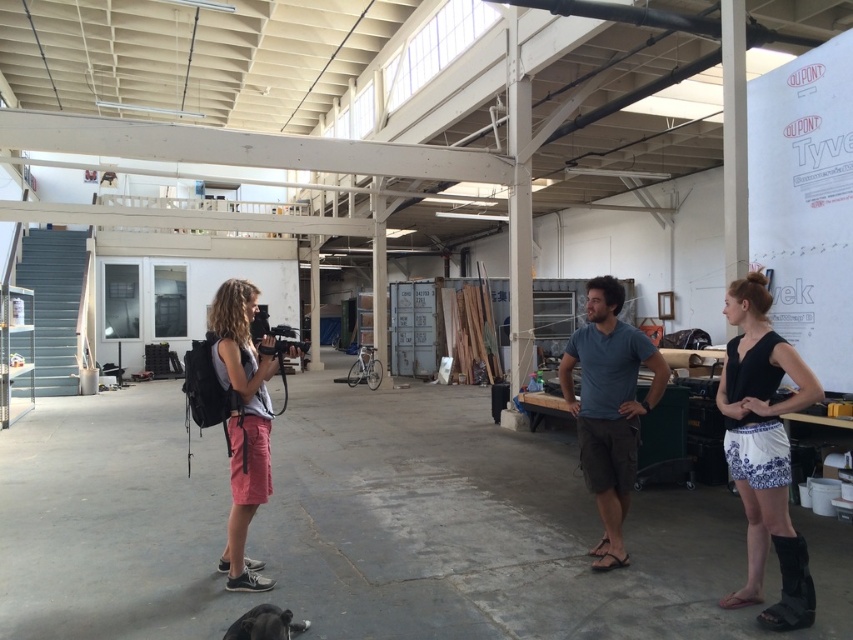
Question: Observing the image, what is the correct spatial positioning of blue cotton shirt at center in reference to matte black camera at left?

Choices:
 (A) above
 (B) below

Answer: (B)

Question: Which object is closer to the camera taking this photo?

Choices:
 (A) blue cotton shirt at center
 (B) matte black camera at left

Answer: (B)

Question: Is black matte shorts at right positioned in front of matte black camera at left?

Choices:
 (A) yes
 (B) no

Answer: (A)

Question: Which object is the farthest from the black matte shorts at right?

Choices:
 (A) matte black camera at left
 (B) blue cotton shirt at center

Answer: (A)

Question: Which point is farther to the camera?

Choices:
 (A) (236, 317)
 (B) (622, 358)
 (C) (811, 620)

Answer: (B)

Question: Observing the image, what is the correct spatial positioning of blue cotton shirt at center in reference to matte black camera at left?

Choices:
 (A) above
 (B) below

Answer: (B)